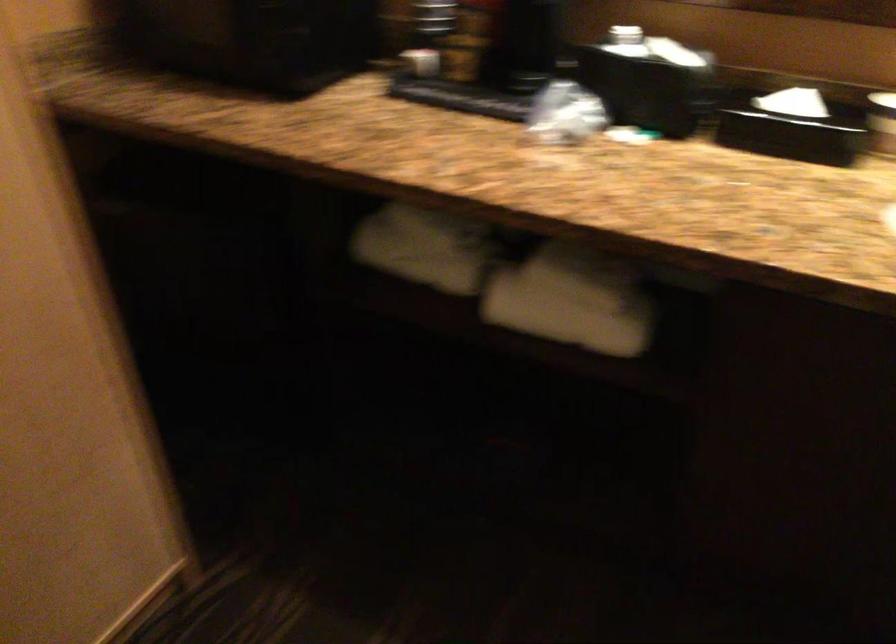
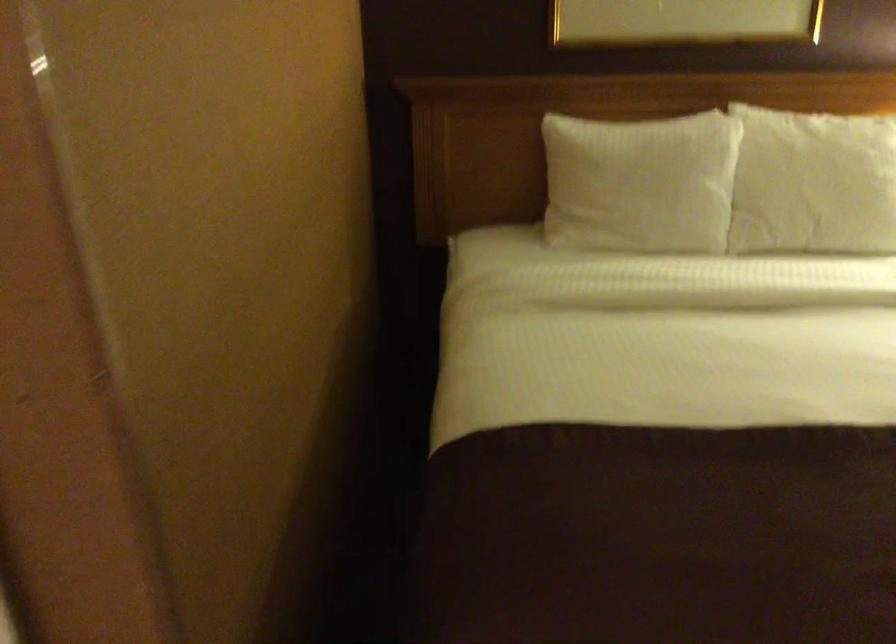
How did the camera likely rotate?

The camera's rotation is toward right-down.